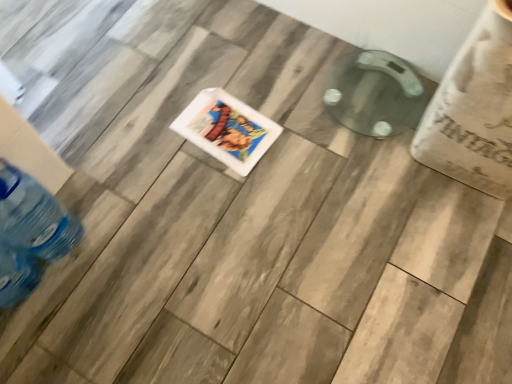
This screenshot has height=384, width=512. In order to click on free location to the right of translucent plastic bottle at lower left in this screenshot , I will do `click(123, 244)`.